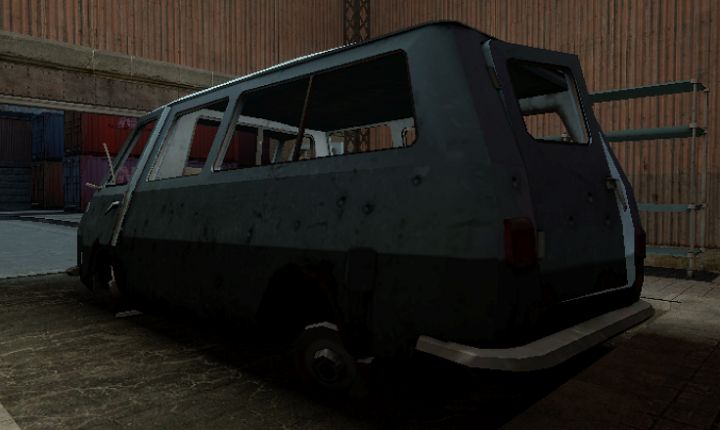
You are a GUI agent. You are given a task and a screenshot of the screen. Output one action in this format:
    pyautogui.click(x=<x>, y=<y>)
    Task: Click on the windows
    The image size is (720, 430).
    Given the screenshot: What is the action you would take?
    pyautogui.click(x=193, y=146), pyautogui.click(x=258, y=135), pyautogui.click(x=350, y=124), pyautogui.click(x=546, y=92), pyautogui.click(x=140, y=150)